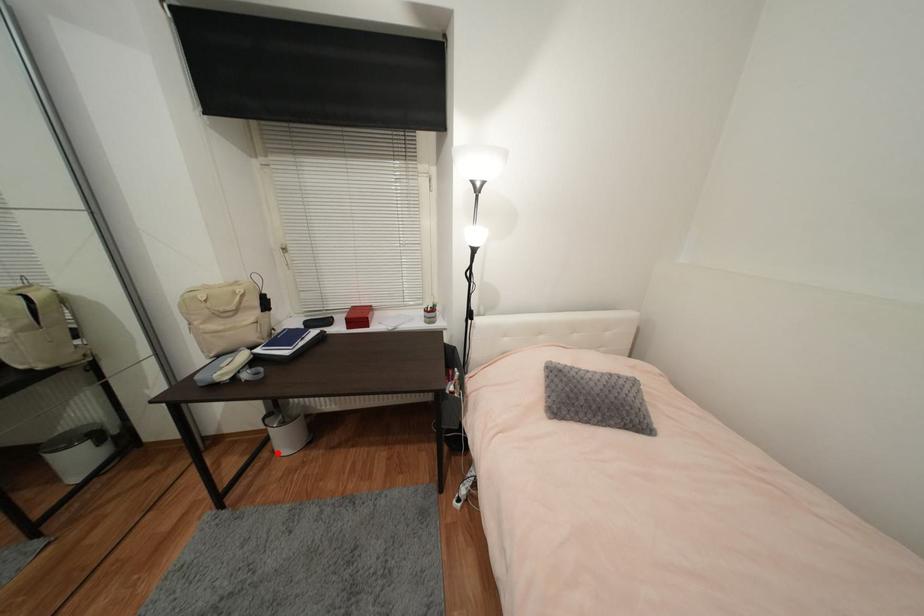
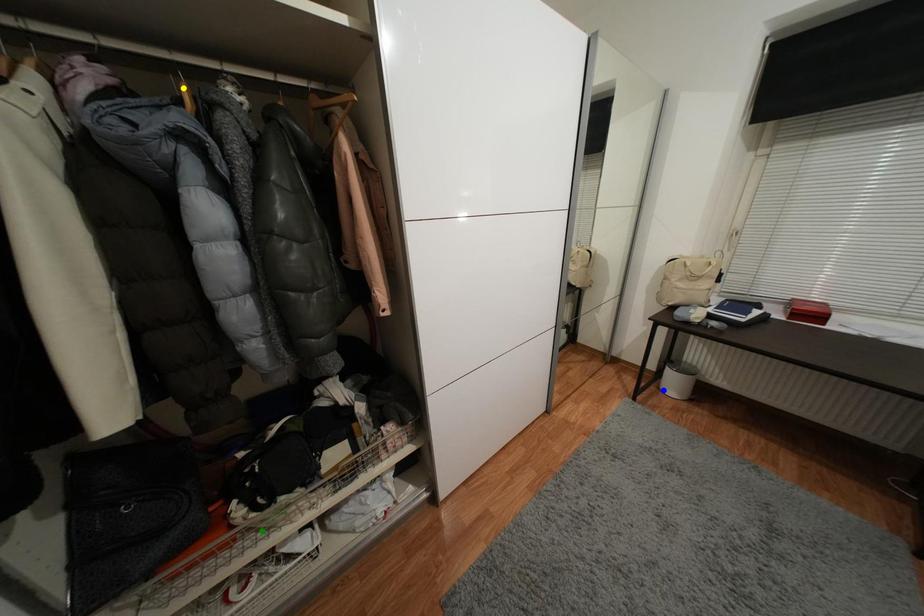
Question: I am providing you with two images of the same scene from different viewpoints. A red point is marked on the first image. You are given multiple points on the second image. Which spot in image 2 lines up with the point in image 1?

Choices:
 (A) yellow point
 (B) green point
 (C) blue point

Answer: (C)